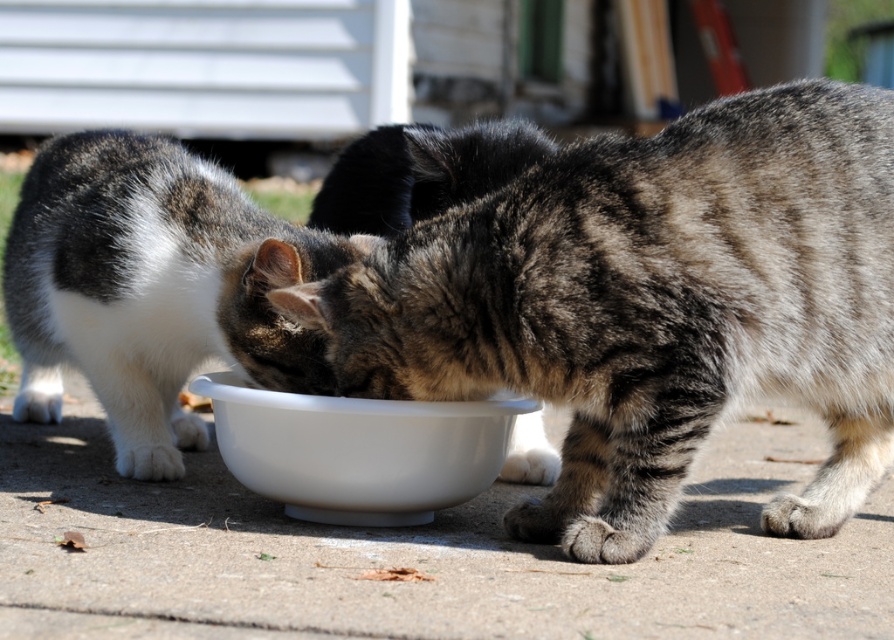
Does tabby fur cat at center appear under white glossy bowl at center?

No.

Is the position of tabby fur cat at center more distant than that of white glossy bowl at center?

No.

The width and height of the screenshot is (894, 640). In order to click on tabby fur cat at center in this screenshot , I will do `click(652, 305)`.

In order to click on tabby fur cat at center in this screenshot , I will do `click(652, 305)`.

Can you confirm if tabby fur cat at left is taller than white glossy bowl at center?

Correct, tabby fur cat at left is much taller as white glossy bowl at center.

Who is shorter, tabby fur cat at left or white glossy bowl at center?

Standing shorter between the two is white glossy bowl at center.

Locate an element on the screen. The height and width of the screenshot is (640, 894). tabby fur cat at left is located at coordinates (152, 289).

What are the coordinates of `tabby fur cat at left` in the screenshot? It's located at (152, 289).

Based on the photo, who is positioned more to the right, tabby fur cat at center or tabby fur cat at left?

From the viewer's perspective, tabby fur cat at center appears more on the right side.

Locate an element on the screen. The width and height of the screenshot is (894, 640). tabby fur cat at center is located at coordinates (652, 305).